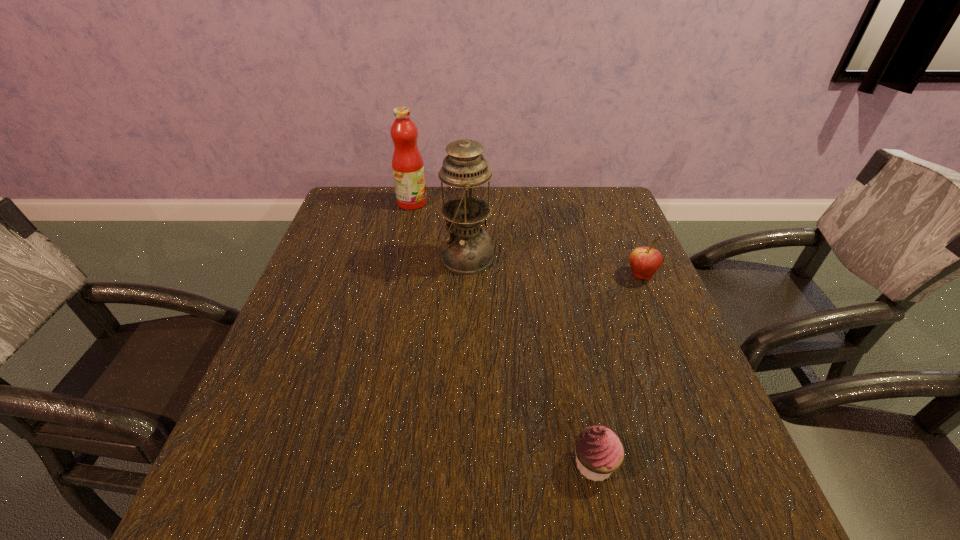
Find the location of a particular element. This screenshot has width=960, height=540. object that can be found as the second closest to the oil lamp is located at coordinates (644, 261).

Locate an element on the screen. the second closest object to the apple is located at coordinates (599, 452).

Image resolution: width=960 pixels, height=540 pixels. In order to click on free point that satisfies the following two spatial constraints: 1. on the front side of the rightmost object; 2. on the right side of the second object from left to right in this screenshot , I will do `click(465, 276)`.

Identify the location of vacant position in the image that satisfies the following two spatial constraints: 1. on the front label of the nearest object; 2. on the left side of the fruit juice. (355, 464).

Locate an element on the screen. This screenshot has height=540, width=960. vacant space that satisfies the following two spatial constraints: 1. on the front label of the farthest object; 2. on the left side of the rightmost object is located at coordinates (396, 276).

Image resolution: width=960 pixels, height=540 pixels. I want to click on vacant region that satisfies the following two spatial constraints: 1. on the front label of the apple; 2. on the left side of the leftmost object, so click(x=396, y=276).

Where is `free location that satisfies the following two spatial constraints: 1. on the front label of the oil lamp; 2. on the left side of the leftmost object`? This screenshot has width=960, height=540. free location that satisfies the following two spatial constraints: 1. on the front label of the oil lamp; 2. on the left side of the leftmost object is located at coordinates (400, 258).

Identify the location of vacant space that satisfies the following two spatial constraints: 1. on the front label of the farthest object; 2. on the back side of the cupcake. (355, 464).

This screenshot has width=960, height=540. I want to click on free location that satisfies the following two spatial constraints: 1. on the front side of the third object from right to left; 2. on the left side of the rightmost object, so click(x=465, y=276).

Identify the location of free region that satisfies the following two spatial constraints: 1. on the back side of the nearest object; 2. on the front label of the leftmost object. Image resolution: width=960 pixels, height=540 pixels. (542, 202).